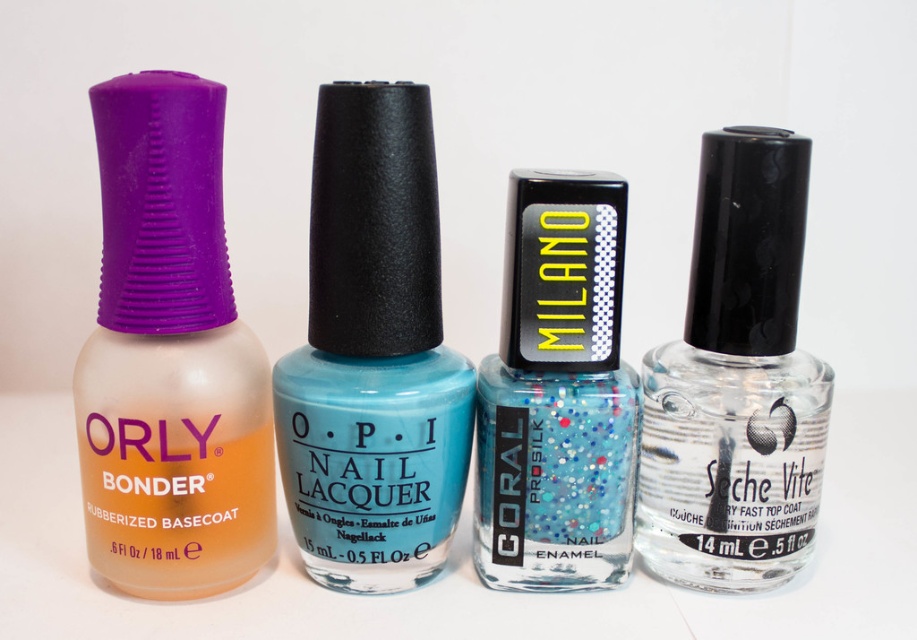
Question: Estimate the real-world distances between objects in this image. Which object is farther from the teal glossy nail lacquer at center?

Choices:
 (A) glittery blue nail enamel at center
 (B) matte orange nail polish at left

Answer: (B)

Question: Which of the following is the closest to the observer?

Choices:
 (A) clear glass nail polish at right
 (B) teal glossy nail lacquer at center

Answer: (B)

Question: Which point is farther to the camera?

Choices:
 (A) teal glossy nail lacquer at center
 (B) clear glass nail polish at right
 (C) matte orange nail polish at left
 (D) glittery blue nail enamel at center

Answer: (B)

Question: Is teal glossy nail lacquer at center thinner than clear glass nail polish at right?

Choices:
 (A) no
 (B) yes

Answer: (A)

Question: Does matte orange nail polish at left appear on the right side of teal glossy nail lacquer at center?

Choices:
 (A) yes
 (B) no

Answer: (B)

Question: Is the position of teal glossy nail lacquer at center more distant than that of glittery blue nail enamel at center?

Choices:
 (A) no
 (B) yes

Answer: (A)